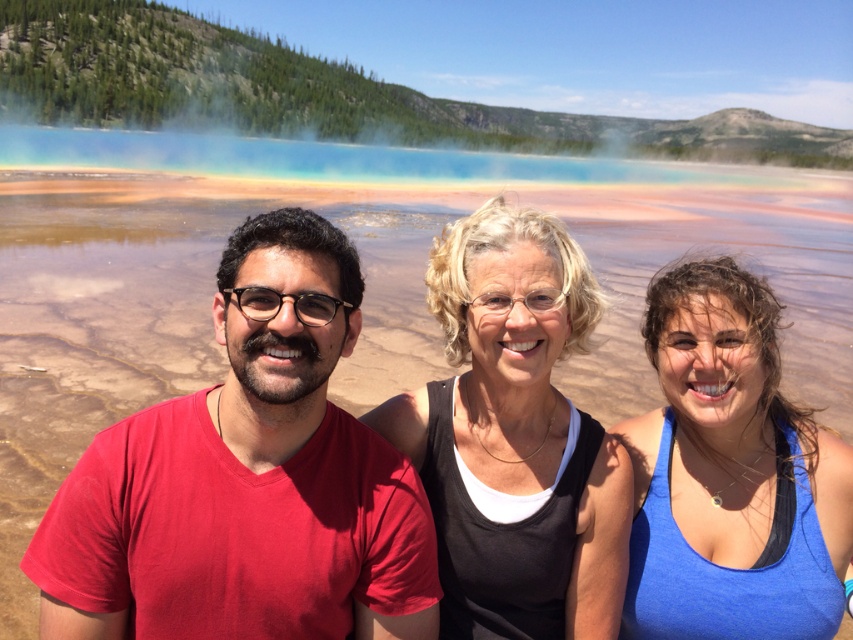
Question: Which point appears closest to the camera in this image?

Choices:
 (A) (74, 224)
 (B) (740, 618)
 (C) (426, 632)
 (D) (556, 419)

Answer: (C)

Question: Is red matte t-shirt at left smaller than matte red t-shirt at center?

Choices:
 (A) no
 (B) yes

Answer: (A)

Question: Is matte red t-shirt at center above black matte tank top at center?

Choices:
 (A) yes
 (B) no

Answer: (B)

Question: Among these objects, which one is nearest to the camera?

Choices:
 (A) matte red t-shirt at center
 (B) blue fabric tank top at center
 (C) black matte tank top at center

Answer: (A)

Question: Estimate the real-world distances between objects in this image. Which object is farther from the blue fabric tank top at center?

Choices:
 (A) matte red t-shirt at center
 (B) black matte tank top at center
 (C) red matte t-shirt at left

Answer: (C)

Question: Is red matte t-shirt at left closer to the viewer compared to matte red t-shirt at center?

Choices:
 (A) no
 (B) yes

Answer: (A)